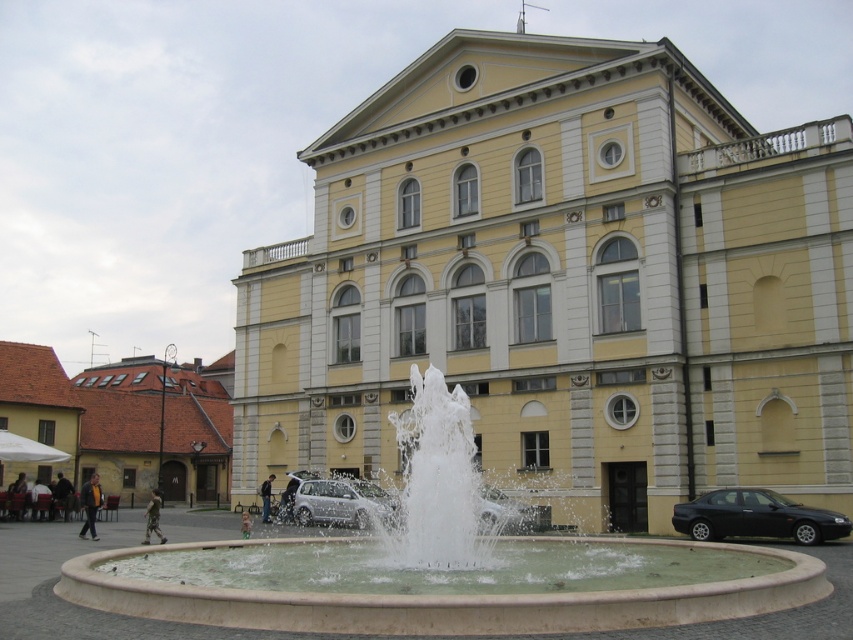
Is white stone fountain at center wider than yellow fabric jacket at lower left?

Indeed, white stone fountain at center has a greater width compared to yellow fabric jacket at lower left.

In the scene shown: Does white stone fountain at center have a lesser height compared to yellow fabric jacket at lower left?

No.

Is point (465, 410) closer to camera compared to point (96, 492)?

Yes.

You are a GUI agent. You are given a task and a screenshot of the screen. Output one action in this format:
    pyautogui.click(x=<x>, y=<y>)
    Task: Click on the white stone fountain at center
    
    Given the screenshot: What is the action you would take?
    pyautogui.click(x=442, y=564)

Does black metallic sedan at lower right lie behind camouflage fabric person at center?

That is False.

Is point (706, 525) more distant than point (158, 506)?

No, (706, 525) is closer to viewer.

This screenshot has height=640, width=853. Find the location of `black metallic sedan at lower right`. black metallic sedan at lower right is located at coordinates (756, 516).

Is silver metallic hatchback at center shorter than yellow fabric jacket at lower left?

Correct, silver metallic hatchback at center is not as tall as yellow fabric jacket at lower left.

Is silver metallic hatchback at center in front of yellow fabric jacket at lower left?

Yes, it is.

Is point (347, 513) more distant than point (97, 502)?

Yes, it is behind point (97, 502).

Identify the location of silver metallic hatchback at center. (341, 502).